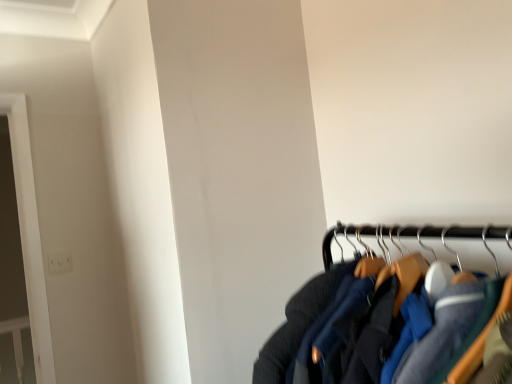
Question: Should I look upward or downward to see white plastic electric outlet at upper left?

Choices:
 (A) down
 (B) up

Answer: (A)

Question: Is dark blue fabric jacket at lower right oriented away from white plastic electric outlet at upper left?

Choices:
 (A) no
 (B) yes

Answer: (A)

Question: Can you confirm if dark blue fabric jacket at lower right is shorter than white plastic electric outlet at upper left?

Choices:
 (A) yes
 (B) no

Answer: (B)

Question: From the image's perspective, would you say dark blue fabric jacket at lower right is positioned over white plastic electric outlet at upper left?

Choices:
 (A) no
 (B) yes

Answer: (B)

Question: Does dark blue fabric jacket at lower right appear on the right side of white plastic electric outlet at upper left?

Choices:
 (A) yes
 (B) no

Answer: (A)

Question: Would you consider dark blue fabric jacket at lower right to be distant from white plastic electric outlet at upper left?

Choices:
 (A) no
 (B) yes

Answer: (B)

Question: Is dark blue fabric jacket at lower right outside white plastic electric outlet at upper left?

Choices:
 (A) no
 (B) yes

Answer: (B)

Question: From the image's perspective, would you say white plastic electric outlet at upper left is positioned over dark blue fabric jacket at lower right?

Choices:
 (A) yes
 (B) no

Answer: (B)

Question: Is white plastic electric outlet at upper left positioned before dark blue fabric jacket at lower right?

Choices:
 (A) no
 (B) yes

Answer: (A)

Question: Does white plastic electric outlet at upper left have a lesser height compared to dark blue fabric jacket at lower right?

Choices:
 (A) yes
 (B) no

Answer: (A)

Question: Can you confirm if white plastic electric outlet at upper left is positioned to the right of dark blue fabric jacket at lower right?

Choices:
 (A) no
 (B) yes

Answer: (A)

Question: From a real-world perspective, is white plastic electric outlet at upper left on dark blue fabric jacket at lower right?

Choices:
 (A) no
 (B) yes

Answer: (B)

Question: Does white plastic electric outlet at upper left have a larger size compared to dark blue fabric jacket at lower right?

Choices:
 (A) no
 (B) yes

Answer: (A)

Question: Based on their positions, is dark blue fabric jacket at lower right located to the left or right of white plastic electric outlet at upper left?

Choices:
 (A) right
 (B) left

Answer: (A)